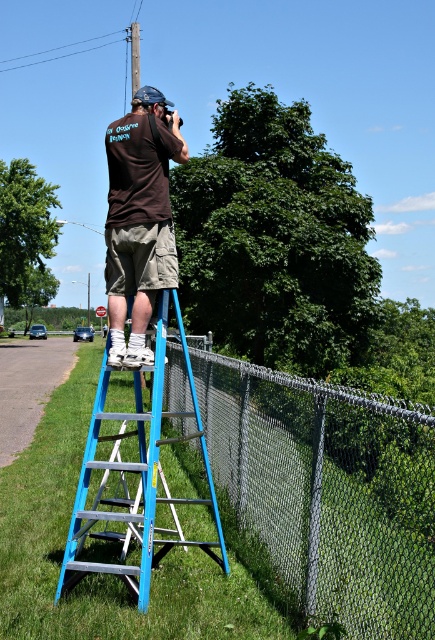
You are a painter who needs to climb the blue aluminum ladder at center to reach a high point to paint a mural on the fence. However, there is a brushed metal telegraph pole at upper center in the way. Based on their positions, can you determine if the ladder is positioned to the left or right of the telegraph pole?

The blue aluminum ladder at center is positioned to the right of the brushed metal telegraph pole at upper center.

You are a photographer trying to frame a shot of the brown cotton shirt at center. Where exactly should you position your camera to capture it perfectly?

The brown cotton shirt at center is located at the 2D coordinates point [140,218], so position your camera to aim precisely at that point to capture it perfectly.